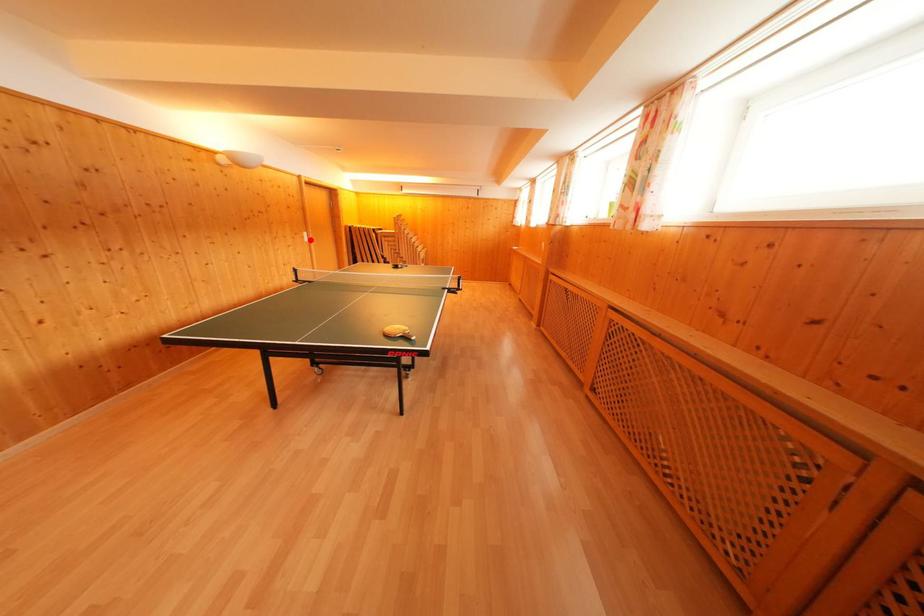
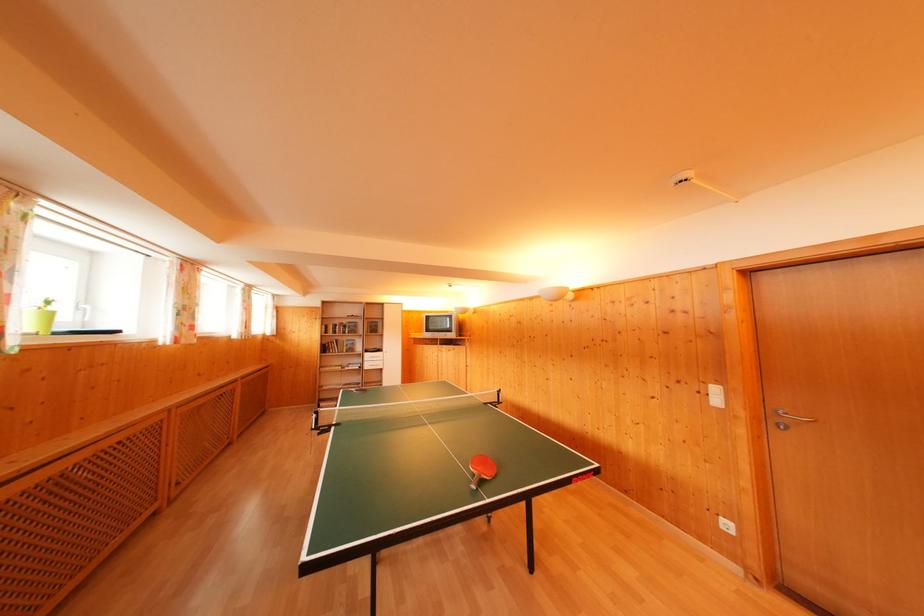
Question: A red point is marked in image1. In image2, is the corresponding 3D point closer to the camera or farther? Reply with the corresponding letter.

Choices:
 (A) The corresponding 3D point is closer.
 (B) The corresponding 3D point is farther.

Answer: (B)